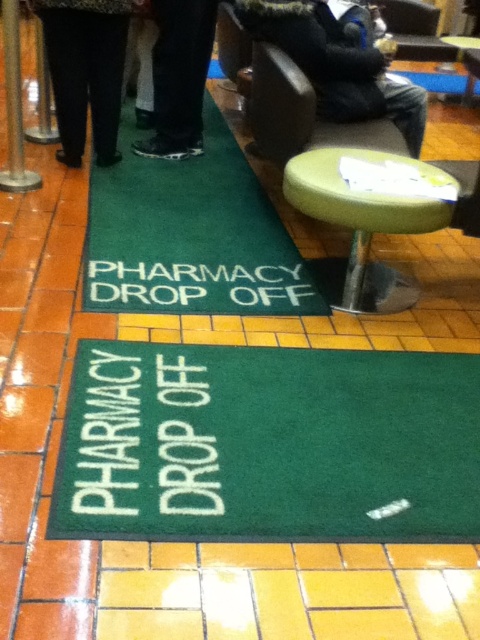
You are a customer who just arrived at the pharmacy drop off area. You see a dark brown leather jacket at upper center and black leather shoes at center. Which item is positioned more to the right side?

The dark brown leather jacket at upper center is positioned more to the right side compared to the black leather shoes at center.

You are a delivery person who needs to place a package on the green carpet at center. However, there is a green fabric stool at center in the way. Can you move the stool to the side to make space?

The green carpet at center might be wider than green fabric stool at center, so moving the stool to the side could allow enough space to place the package on the green carpet at center.